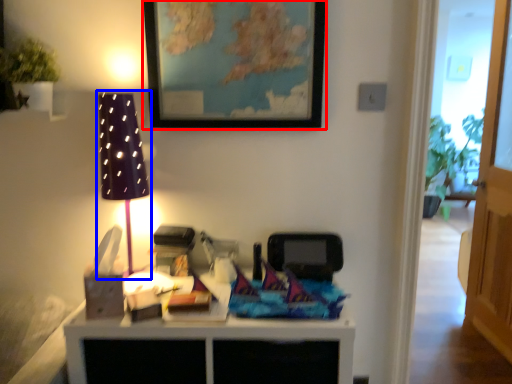
Question: Which of the following is the farthest to the observer, picture frame (highlighted by a red box) or table lamp (highlighted by a blue box)?

Choices:
 (A) picture frame
 (B) table lamp

Answer: (A)